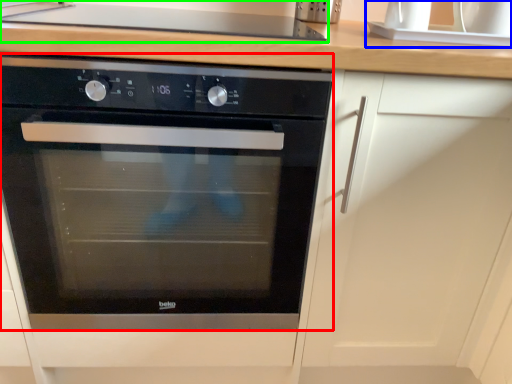
Question: Which is nearer to the oven (highlighted by a red box)? sink (highlighted by a blue box) or gas stove (highlighted by a green box).

Choices:
 (A) sink
 (B) gas stove

Answer: (B)